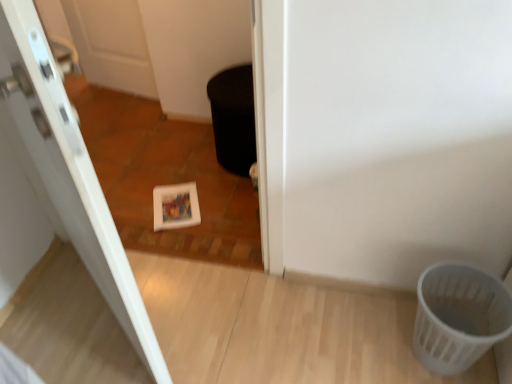
In order to click on vacant area that lies to the right of white glossy door at upper left in this screenshot , I will do click(220, 316).